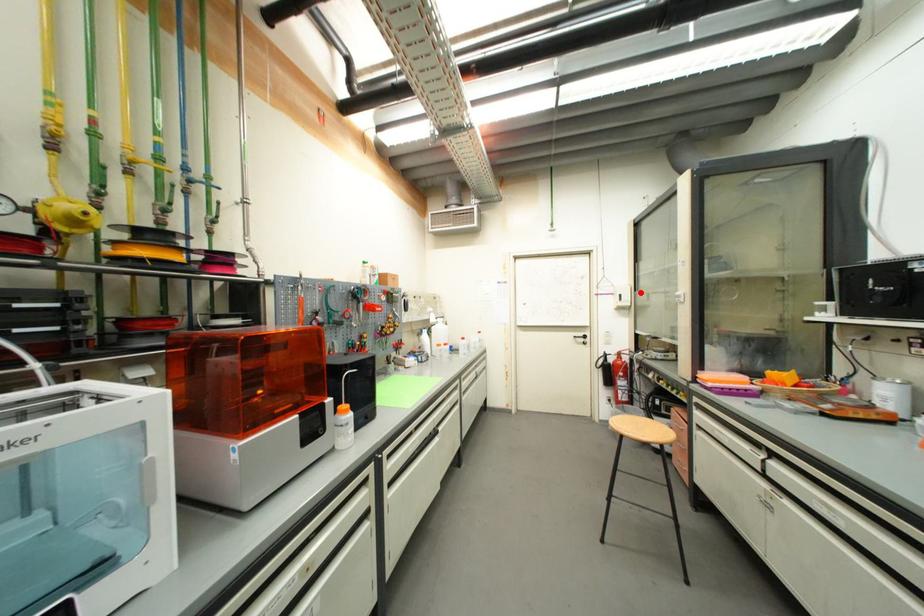
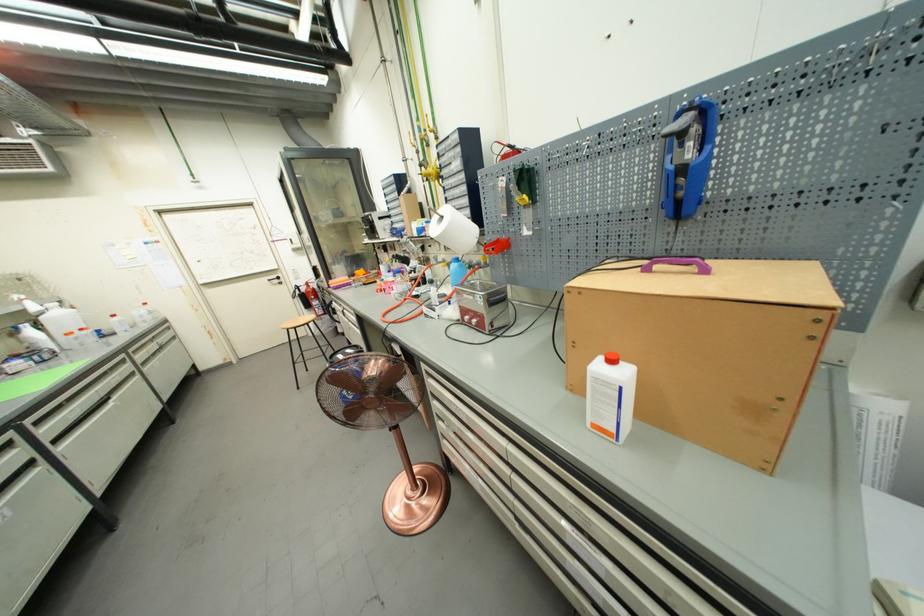
Question: I am providing you with two images of the same scene from different viewpoints. A red point is shown in image1. For the corresponding object point in image2, is it positioned nearer or farther from the camera?

Choices:
 (A) Nearer
 (B) Farther

Answer: (A)